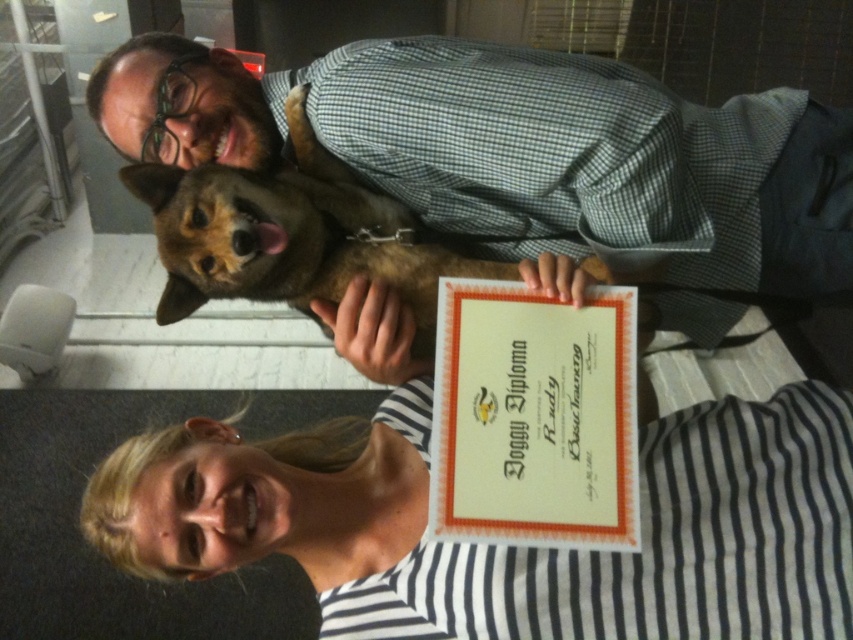
Question: Does orange paper doggy diploma at center have a larger size compared to brown furry dog at upper center?

Choices:
 (A) no
 (B) yes

Answer: (A)

Question: Among these points, which one is nearest to the camera?

Choices:
 (A) (587, 452)
 (B) (282, 220)

Answer: (A)

Question: Can you confirm if orange paper doggy diploma at center is bigger than brown furry dog at upper center?

Choices:
 (A) no
 (B) yes

Answer: (A)

Question: In this image, where is orange paper doggy diploma at center located relative to brown furry dog at upper center?

Choices:
 (A) right
 (B) left

Answer: (A)

Question: Which point is closer to the camera taking this photo?

Choices:
 (A) (581, 364)
 (B) (265, 257)

Answer: (A)